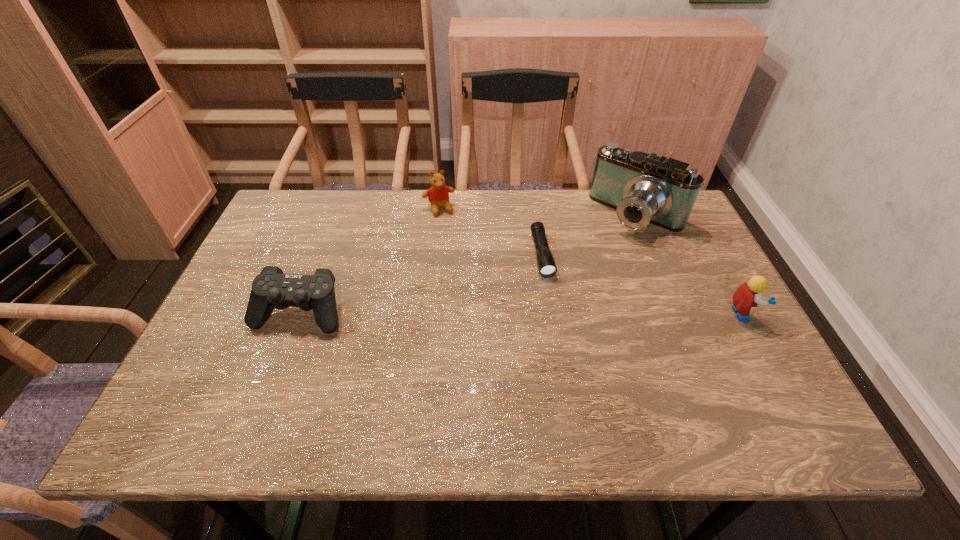
Locate an element on the screen. The width and height of the screenshot is (960, 540). free space between the Lego and the shortest object is located at coordinates (642, 284).

This screenshot has height=540, width=960. In order to click on unoccupied position between the Lego and the tallest object in this screenshot , I will do `click(689, 264)`.

Identify the location of free space that is in between the second object from left to right and the second shortest object. The height and width of the screenshot is (540, 960). (370, 261).

The image size is (960, 540). I want to click on empty space between the Lego and the shortest object, so click(642, 284).

The width and height of the screenshot is (960, 540). I want to click on vacant region between the fourth object from right to left and the Lego, so click(x=590, y=261).

At what (x,y) coordinates should I click in order to perform the action: click on free space that is in between the third object from left to right and the teddy bear. Please return your answer as a coordinate pair (x, y). The width and height of the screenshot is (960, 540). Looking at the image, I should click on (491, 232).

Locate an element on the screen. This screenshot has height=540, width=960. free space between the shortest object and the second object from left to right is located at coordinates (491, 232).

Where is `free space between the Lego and the second object from left to right`? Image resolution: width=960 pixels, height=540 pixels. free space between the Lego and the second object from left to right is located at coordinates (590, 261).

The height and width of the screenshot is (540, 960). What are the coordinates of `empty space that is in between the Lego and the camcorder` in the screenshot? It's located at (689, 264).

You are a GUI agent. You are given a task and a screenshot of the screen. Output one action in this format:
    pyautogui.click(x=<x>, y=<y>)
    Task: Click on the vacant area between the fourth object from right to left and the shortest object
    
    Given the screenshot: What is the action you would take?
    pyautogui.click(x=491, y=232)